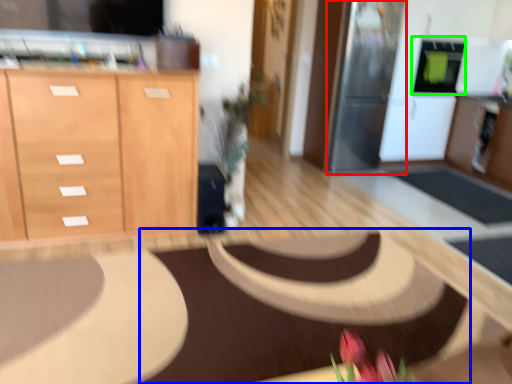
Question: Which is nearer to the appliance (highlighted by a red box)? mat (highlighted by a blue box) or appliance (highlighted by a green box).

Choices:
 (A) mat
 (B) appliance

Answer: (B)